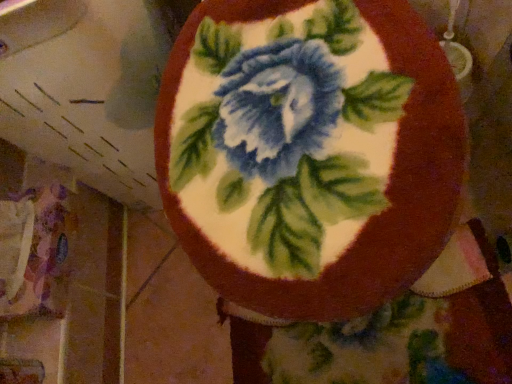
What do you see at coordinates (310, 158) in the screenshot? I see `matte ceramic platter at center` at bounding box center [310, 158].

Measure the distance between point (224, 44) and camera.

Point (224, 44) and camera are 52.70 centimeters apart from each other.

This screenshot has width=512, height=384. I want to click on matte ceramic platter at center, so (x=310, y=158).

Locate an element on the screen. Image resolution: width=512 pixels, height=384 pixels. matte ceramic platter at center is located at coordinates (310, 158).